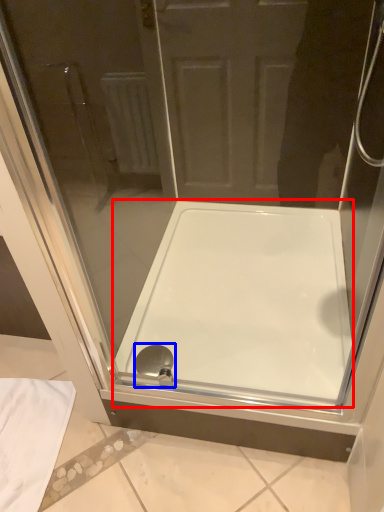
Question: Which of the following is the closest to the observer, bathtub (highlighted by a red box) or shower (highlighted by a blue box)?

Choices:
 (A) bathtub
 (B) shower

Answer: (A)